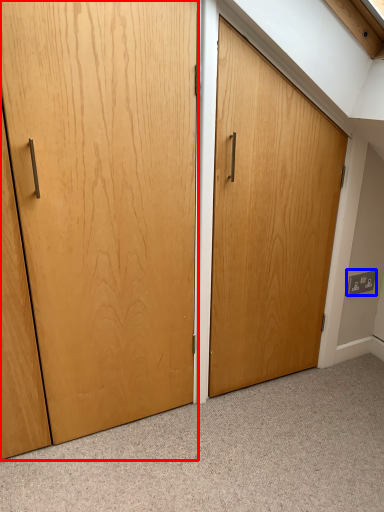
Question: Among these objects, which one is farthest to the camera, door (highlighted by a red box) or electric outlet (highlighted by a blue box)?

Choices:
 (A) door
 (B) electric outlet

Answer: (B)